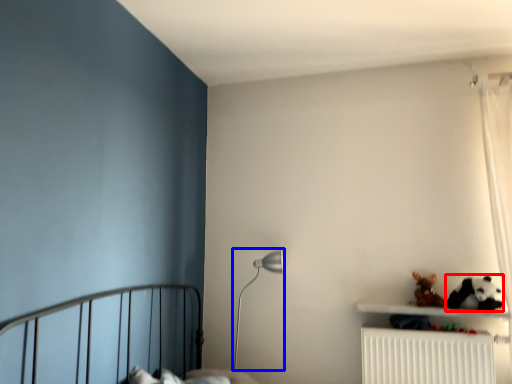
Question: Which point is further to the camera, animal (highlighted by a red box) or table lamp (highlighted by a blue box)?

Choices:
 (A) animal
 (B) table lamp

Answer: (B)